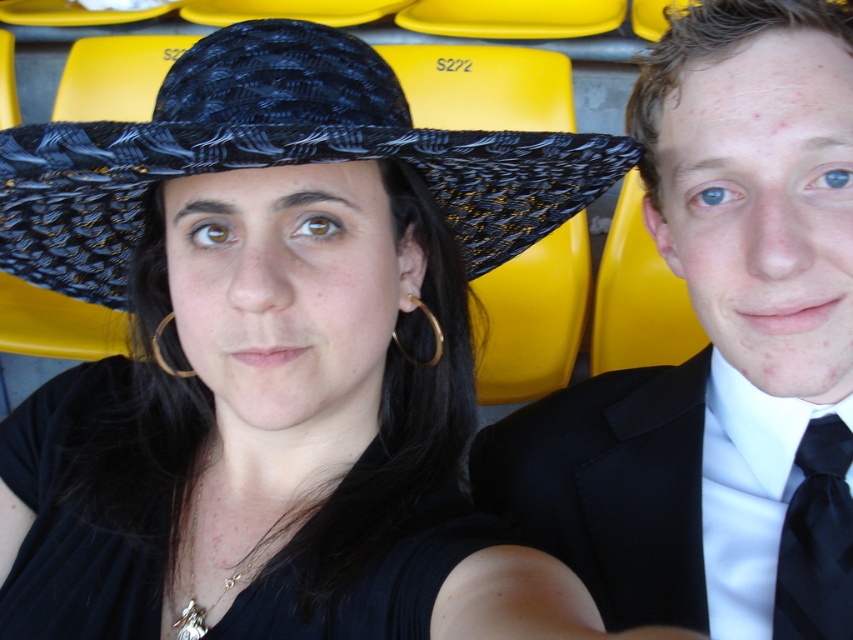
Locate an element on the screen. The width and height of the screenshot is (853, 640). black woven hat at center is located at coordinates (276, 156).

Who is more distant from viewer, (68, 145) or (820, 579)?

→ Positioned behind is point (820, 579).

Find the location of a particular element. black woven hat at center is located at coordinates (276, 156).

Between point (44, 198) and point (297, 620), which one is positioned behind?

The point (44, 198) is behind.

Is point (84, 273) behind point (91, 628)?

Yes, it is behind point (91, 628).

The width and height of the screenshot is (853, 640). I want to click on black woven hat at center, so click(x=276, y=156).

Is black matte dress at center shorter than black silk tie at right?

In fact, black matte dress at center may be taller than black silk tie at right.

Who is positioned more to the left, black matte dress at center or black silk tie at right?

From the viewer's perspective, black matte dress at center appears more on the left side.

Measure the distance between point (151, 628) and camera.

Point (151, 628) is 67.06 centimeters away from camera.

Where is `black matte dress at center`? black matte dress at center is located at coordinates (74, 518).